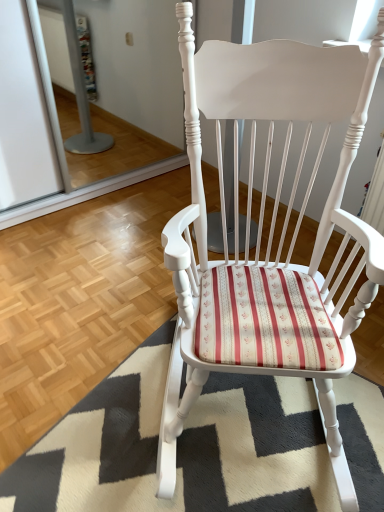
What are the coordinates of `white painted wood rocking chair at center` in the screenshot? It's located at (263, 211).

The image size is (384, 512). What do you see at coordinates (263, 211) in the screenshot?
I see `white painted wood rocking chair at center` at bounding box center [263, 211].

Measure the distance between white painted wood rocking chair at center and camera.

white painted wood rocking chair at center and camera are 1.02 meters apart.

This screenshot has height=512, width=384. Identify the location of white textured rug at center. (180, 446).

Measure the distance between point (136, 402) and camera.

They are 4.81 feet apart.

What do you see at coordinates (180, 446) in the screenshot?
I see `white textured rug at center` at bounding box center [180, 446].

This screenshot has height=512, width=384. Identify the location of white painted wood rocking chair at center. [x=263, y=211].

Is white textured rug at center at the right side of white painted wood rocking chair at center?

In fact, white textured rug at center is to the left of white painted wood rocking chair at center.

Relative to white painted wood rocking chair at center, is white textured rug at center in front or behind?

Visually, white textured rug at center is located behind white painted wood rocking chair at center.

Is point (77, 471) farther from viewer compared to point (202, 65)?

Yes, point (77, 471) is behind point (202, 65).

From the image's perspective, which is above, white textured rug at center or white painted wood rocking chair at center?

white painted wood rocking chair at center appears higher in the image.

From a real-world perspective, is white textured rug at center on top of white painted wood rocking chair at center?

No, from a real-world perspective, white textured rug at center is not on top of white painted wood rocking chair at center.

Which of these two, white textured rug at center or white painted wood rocking chair at center, is wider?

Wider between the two is white textured rug at center.

Which of these two, white textured rug at center or white painted wood rocking chair at center, stands shorter?

white textured rug at center is shorter.

Which of these two, white textured rug at center or white painted wood rocking chair at center, is bigger?

With larger size is white painted wood rocking chair at center.

Is white textured rug at center inside or outside of white painted wood rocking chair at center?

white textured rug at center is not inside white painted wood rocking chair at center, it's outside.

Is white textured rug at center positioned far away from white painted wood rocking chair at center?

Actually, white textured rug at center and white painted wood rocking chair at center are a little close together.

Could you tell me if white textured rug at center is turned towards white painted wood rocking chair at center?

No, white textured rug at center is not oriented towards white painted wood rocking chair at center.

Measure the distance between white textured rug at center and white painted wood rocking chair at center.

The distance of white textured rug at center from white painted wood rocking chair at center is 37.47 centimeters.

Locate an element on the screen. This screenshot has height=512, width=384. chair on the right of white textured rug at center is located at coordinates (263, 211).

Considering the positions of objects white painted wood rocking chair at center and white textured rug at center in the image provided, who is more to the right, white painted wood rocking chair at center or white textured rug at center?

white painted wood rocking chair at center is more to the right.

Does white painted wood rocking chair at center lie in front of white textured rug at center?

Yes.

Is point (324, 83) closer or farther from the camera than point (31, 478)?

Point (324, 83) is positioned closer to the camera compared to point (31, 478).

From the image's perspective, is white painted wood rocking chair at center over white textured rug at center?

Yes, from the image's perspective, white painted wood rocking chair at center is on top of white textured rug at center.

From a real-world perspective, is white painted wood rocking chair at center located higher than white textured rug at center?

Correct, in the physical world, white painted wood rocking chair at center is higher than white textured rug at center.

Can you confirm if white painted wood rocking chair at center is wider than white textured rug at center?

No.

Which of these two, white painted wood rocking chair at center or white textured rug at center, stands taller?

white painted wood rocking chair at center.

Between white painted wood rocking chair at center and white textured rug at center, which one has larger size?

white painted wood rocking chair at center is bigger.

Is white painted wood rocking chair at center positioned beyond the bounds of white textured rug at center?

Indeed, white painted wood rocking chair at center is completely outside white textured rug at center.

Is white painted wood rocking chair at center next to white textured rug at center?

No, white painted wood rocking chair at center is not beside white textured rug at center.

Is white painted wood rocking chair at center positioned with its back to white textured rug at center?

No.

How distant is white painted wood rocking chair at center from white textured rug at center?

white painted wood rocking chair at center and white textured rug at center are 14.75 inches apart.

At what (x,y) coordinates should I click in order to perform the action: click on chair that is above the white textured rug at center (from the image's perspective). Please return your answer as a coordinate pair (x, y). The image size is (384, 512). Looking at the image, I should click on (263, 211).

Locate an element on the screen. chair on the right of white textured rug at center is located at coordinates (263, 211).

The image size is (384, 512). Identify the location of doormat that is behind the white painted wood rocking chair at center. (180, 446).